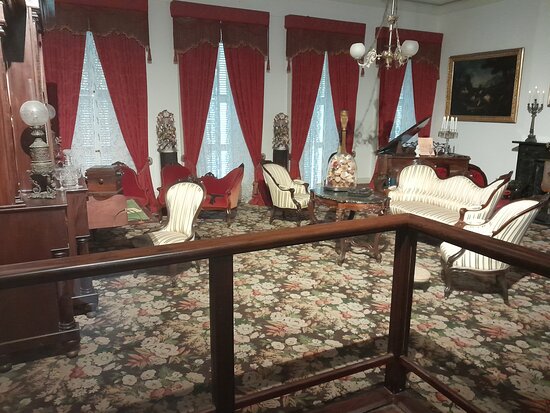
Where is `candle sticks`? The height and width of the screenshot is (413, 550). candle sticks is located at coordinates (533, 105), (446, 130).